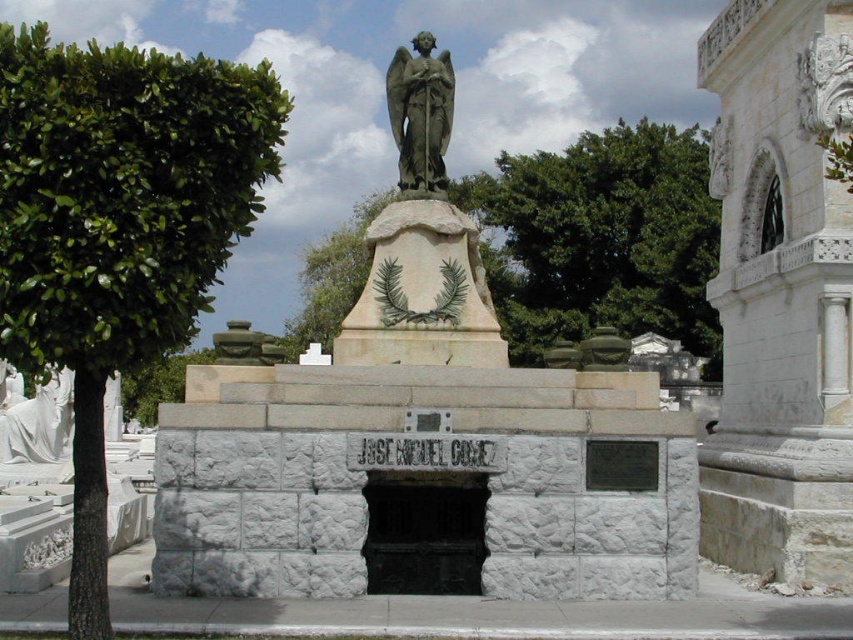
Question: Does green leafy tree at left lie in front of matte stone angel at center?

Choices:
 (A) yes
 (B) no

Answer: (A)

Question: Is green leafy tree at left wider than green leafy tree at upper center?

Choices:
 (A) no
 (B) yes

Answer: (B)

Question: Which of the following is the closest to the observer?

Choices:
 (A) green stone angel at center
 (B) green leafy tree at upper center
 (C) green leafy tree at left
 (D) matte stone angel at center

Answer: (C)

Question: Which object is closer to the camera taking this photo?

Choices:
 (A) green leafy tree at upper center
 (B) green leafy tree at left

Answer: (B)

Question: Can you confirm if green leafy tree at upper center is smaller than green stone angel at center?

Choices:
 (A) no
 (B) yes

Answer: (A)

Question: Estimate the real-world distances between objects in this image. Which object is closer to the matte stone angel at center?

Choices:
 (A) green stone angel at center
 (B) green leafy tree at left

Answer: (A)